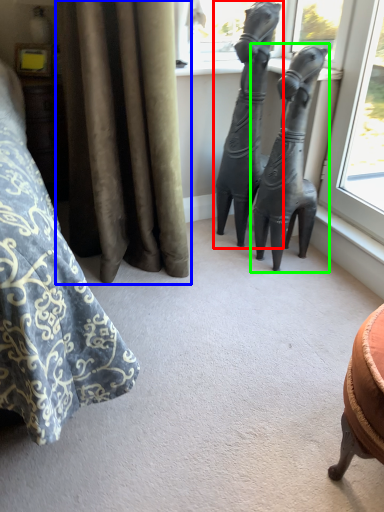
Question: Which is farther away from statue (sculpture) (highlighted by a red box)? curtain (highlighted by a blue box) or statue (sculpture) (highlighted by a green box)?

Choices:
 (A) curtain
 (B) statue (sculpture)

Answer: (A)